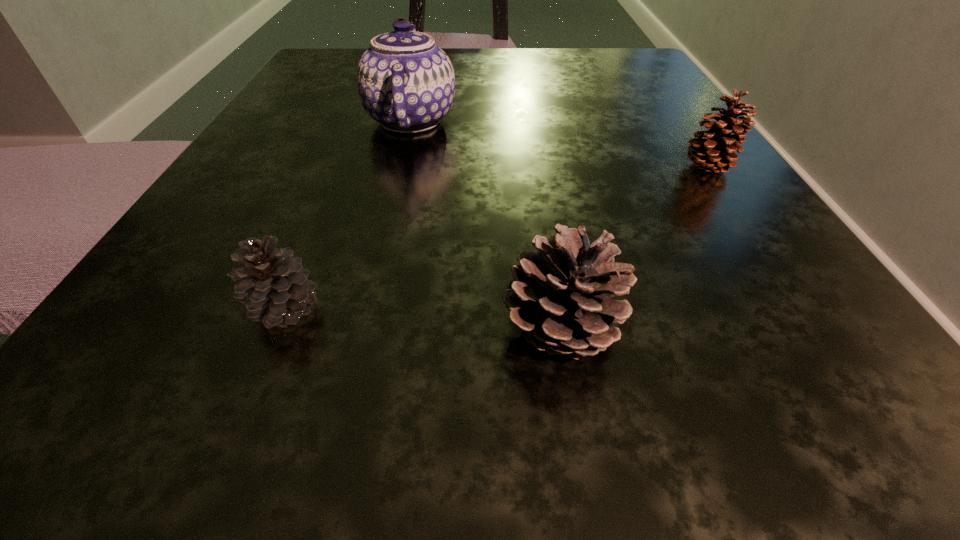
Locate an element on the screen. free space that satisfies the following two spatial constraints: 1. at the spout of the chinaware; 2. on the back side of the second pinecone from left to right is located at coordinates (x=361, y=330).